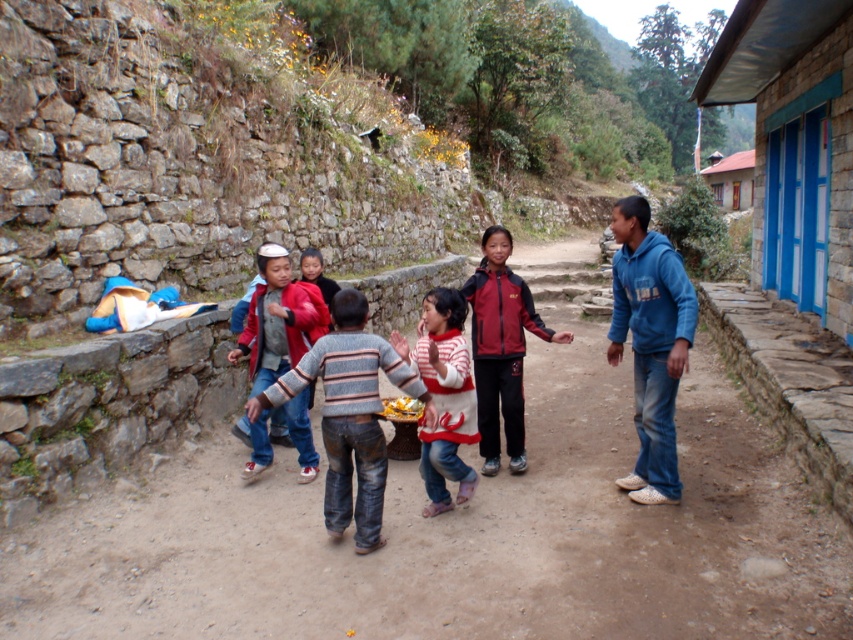
You are a hiker who has just finished a long trek and is now standing at the brown dirt track at center. You want to reach the stone wall on the left side. Which direction should you walk to get there?

To reach the stone wall on the left side from the brown dirt track at center, you should walk towards the left.

You are standing in the middle of the scene and want to reach both the point at coordinates (x=766, y=116) and the point at coordinates (x=747, y=189). Which point will you reach first?

You will reach the point at coordinates (x=766, y=116) first because it is closer to you than the point at coordinates (x=747, y=189).

You are a parent trying to locate your child who is hiding behind either the blue stone building at right or the brown wooden hut at upper right. Which structure is taller and thus offers better hiding space?

The brown wooden hut at upper right is taller than the blue stone building at right, so it offers better hiding space.